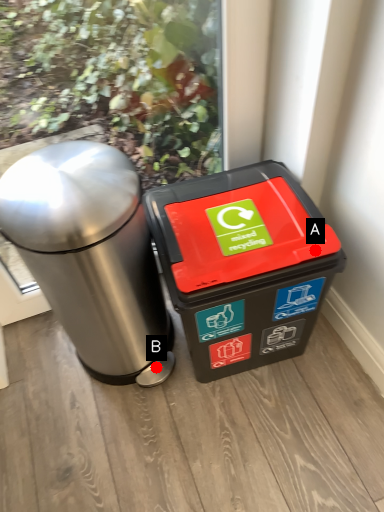
Question: Two points are circled on the image, labeled by A and B beside each circle. Which point is closer to the camera?

Choices:
 (A) A is closer
 (B) B is closer

Answer: (A)